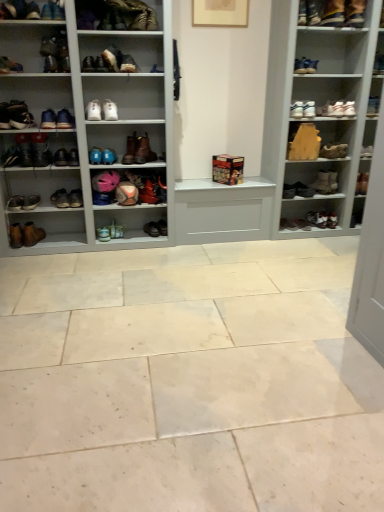
Question: Is matte black shoe at upper left, arranged as the fifth shoe when viewed from the left, in front of leather boot at upper center, which is the 7th footwear from bottom to top?

Choices:
 (A) no
 (B) yes

Answer: (B)

Question: Is matte black shoe at upper left, which ranks as the 24th shoe in right-to-left order, not close to leather boot at upper center, marked as the 4th footwear in a right-to-left arrangement?

Choices:
 (A) no
 (B) yes

Answer: (A)

Question: From the image's perspective, is matte black shoe at upper left, arranged as the fifth shoe when viewed from the left, located beneath leather boot at upper center, marked as the 4th footwear in a right-to-left arrangement?

Choices:
 (A) yes
 (B) no

Answer: (A)

Question: Considering the relative sizes of matte black shoe at upper left, arranged as the fifth shoe when viewed from the left, and leather boot at upper center, which ranks as the 4th footwear in left-to-right order, in the image provided, is matte black shoe at upper left, arranged as the fifth shoe when viewed from the left, bigger than leather boot at upper center, which ranks as the 4th footwear in left-to-right order,?

Choices:
 (A) no
 (B) yes

Answer: (A)

Question: Is matte black shoe at upper left, arranged as the fifth shoe when viewed from the left, behind leather boot at upper center, marked as the 4th footwear in a right-to-left arrangement?

Choices:
 (A) yes
 (B) no

Answer: (B)

Question: From a real-world perspective, is matte black shoe at upper left, which ranks as the 24th shoe in right-to-left order, physically above leather boot at upper center, which ranks as the 4th footwear in left-to-right order?

Choices:
 (A) no
 (B) yes

Answer: (A)

Question: Is matte brown boot at upper left, which ranks as the 10th shoe in left-to-right order, oriented towards blue fabric shoe at center, which is counted as the 16th shoe, starting from the left?

Choices:
 (A) no
 (B) yes

Answer: (A)

Question: Is matte brown boot at upper left, which is the nineteenth shoe from right to left, at the left side of blue fabric shoe at center, arranged as the thirteenth shoe when viewed from the right?

Choices:
 (A) yes
 (B) no

Answer: (A)

Question: Does matte brown boot at upper left, which ranks as the 10th shoe in left-to-right order, appear on the right side of blue fabric shoe at center, arranged as the thirteenth shoe when viewed from the right?

Choices:
 (A) yes
 (B) no

Answer: (B)

Question: From a real-world perspective, is matte brown boot at upper left, which ranks as the 10th shoe in left-to-right order, physically above blue fabric shoe at center, arranged as the thirteenth shoe when viewed from the right?

Choices:
 (A) yes
 (B) no

Answer: (A)

Question: Are matte brown boot at upper left, which ranks as the 10th shoe in left-to-right order, and blue fabric shoe at center, arranged as the thirteenth shoe when viewed from the right, making contact?

Choices:
 (A) no
 (B) yes

Answer: (A)

Question: Considering the relative sizes of matte brown boot at upper left, which is the nineteenth shoe from right to left, and blue fabric shoe at center, arranged as the thirteenth shoe when viewed from the right, in the image provided, is matte brown boot at upper left, which is the nineteenth shoe from right to left, smaller than blue fabric shoe at center, arranged as the thirteenth shoe when viewed from the right,?

Choices:
 (A) yes
 (B) no

Answer: (A)

Question: Does brown leather boot at left, marked as the 25th shoe in a right-to-left arrangement, lie in front of brown leather shoe at lower left, the 23th shoe positioned from the right?

Choices:
 (A) no
 (B) yes

Answer: (B)